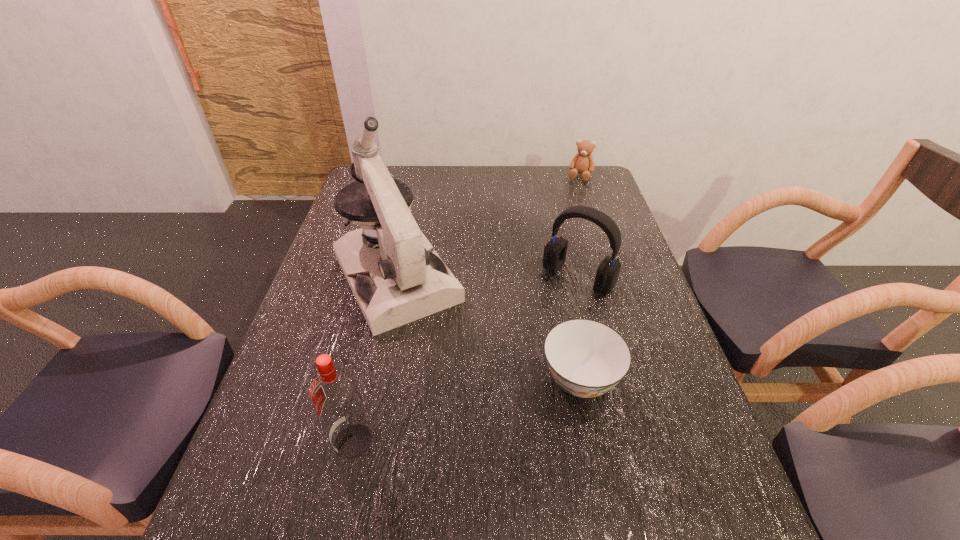
You are a GUI agent. You are given a task and a screenshot of the screen. Output one action in this format:
    pyautogui.click(x=<x>, y=<y>)
    Task: Click on the free space located on the front label of the second tallest object
    This screenshot has height=540, width=960.
    Given the screenshot: What is the action you would take?
    pyautogui.click(x=293, y=442)

Find the location of a particular element. The height and width of the screenshot is (540, 960). vacant space located 0.090m on the right of the soup bowl is located at coordinates (660, 379).

Where is `vacant space located on the headband of the headset`? vacant space located on the headband of the headset is located at coordinates (525, 340).

The width and height of the screenshot is (960, 540). In order to click on vacant space positioned 0.250m on the headband of the headset in this screenshot , I will do `click(513, 356)`.

Find the location of a particular element. The image size is (960, 540). vacant space located on the headband of the headset is located at coordinates (552, 307).

Find the location of a particular element. free spot located on the front-facing side of the farthest object is located at coordinates (572, 197).

This screenshot has height=540, width=960. Identify the location of vacant space located on the front-facing side of the farthest object. (572, 198).

Locate an element on the screen. This screenshot has width=960, height=540. free location located on the front-facing side of the farthest object is located at coordinates (573, 195).

Locate an element on the screen. This screenshot has height=540, width=960. free space located at the eyepiece of the tallest object is located at coordinates (494, 449).

Where is `free space located at the eyepiece of the tallest object`? The image size is (960, 540). free space located at the eyepiece of the tallest object is located at coordinates (471, 409).